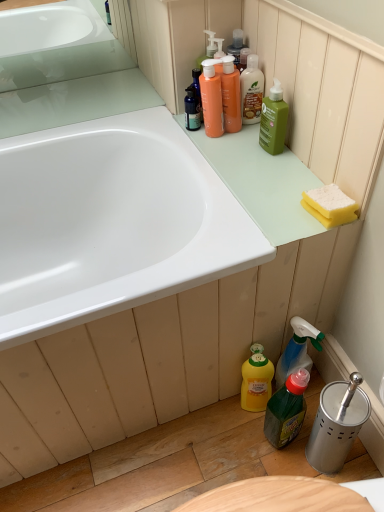
I want to click on free space between yellow sponge at upper right and green matte bottle at upper right, which appears as the 3th cleaning product when viewed from the top, so click(x=293, y=170).